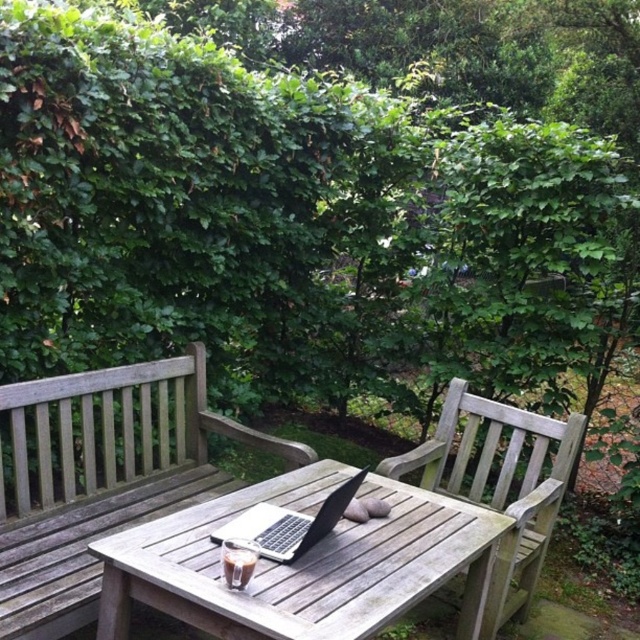
Question: Which of the following is the farthest from the observer?

Choices:
 (A) wooden picnic table at center
 (B) satin black laptop at center
 (C) wooden bench at center
 (D) weathered wood park bench at center

Answer: (D)

Question: Which point is farther to the camera?

Choices:
 (A) (518, 436)
 (B) (3, 472)
 (C) (276, 516)

Answer: (A)

Question: Does wooden picnic table at center appear over weathered wood park bench at center?

Choices:
 (A) yes
 (B) no

Answer: (B)

Question: Observing the image, what is the correct spatial positioning of wooden bench at center in reference to wooden picnic table at center?

Choices:
 (A) below
 (B) above

Answer: (B)

Question: Does wooden bench at center appear over weathered wood park bench at center?

Choices:
 (A) no
 (B) yes

Answer: (B)

Question: Which point is farther to the camera?

Choices:
 (A) (125, 598)
 (B) (525, 528)

Answer: (B)